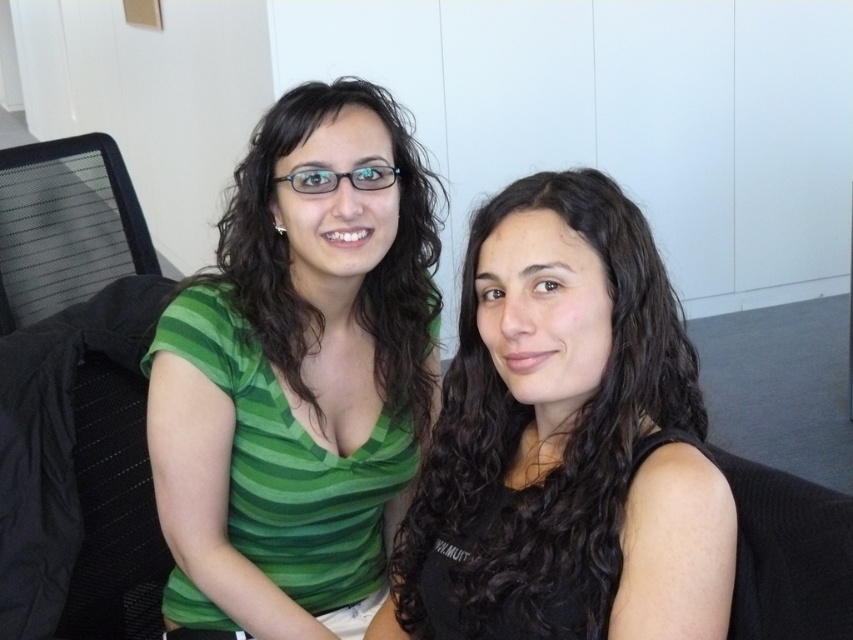
You are taking a photo of two people sitting on a gray carpet. You want to focus on the person closer to the camera. Which point should you focus on, point (212, 378) or point (619, 189)?

You should focus on point (212, 378) because it is closer to the camera than point (619, 189).